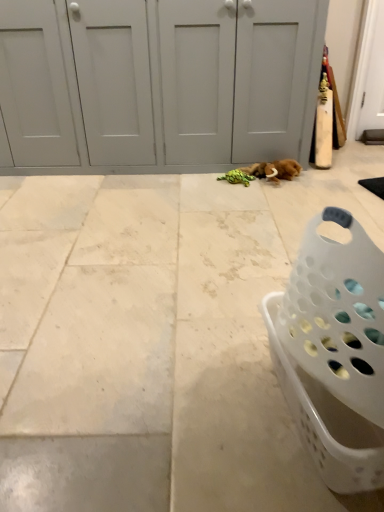
Question: Considering the relative positions of white tile floor at center and white plastic laundry basket at lower right in the image provided, is white tile floor at center to the right of white plastic laundry basket at lower right from the viewer's perspective?

Choices:
 (A) yes
 (B) no

Answer: (B)

Question: Is white tile floor at center at the left side of white plastic laundry basket at lower right?

Choices:
 (A) no
 (B) yes

Answer: (B)

Question: From a real-world perspective, does white tile floor at center stand above white plastic laundry basket at lower right?

Choices:
 (A) no
 (B) yes

Answer: (A)

Question: Is white tile floor at center far away from white plastic laundry basket at lower right?

Choices:
 (A) yes
 (B) no

Answer: (B)

Question: Does white tile floor at center have a greater width compared to white plastic laundry basket at lower right?

Choices:
 (A) yes
 (B) no

Answer: (A)

Question: Does white tile floor at center contain white plastic laundry basket at lower right?

Choices:
 (A) no
 (B) yes

Answer: (A)

Question: Does white plastic laundry basket at lower right have a greater width compared to white matte door at center?

Choices:
 (A) no
 (B) yes

Answer: (A)

Question: Does white plastic laundry basket at lower right have a smaller size compared to white matte door at center?

Choices:
 (A) yes
 (B) no

Answer: (A)

Question: Is white plastic laundry basket at lower right to the left of white matte door at center from the viewer's perspective?

Choices:
 (A) yes
 (B) no

Answer: (B)

Question: Is white plastic laundry basket at lower right bigger than white matte door at center?

Choices:
 (A) no
 (B) yes

Answer: (A)

Question: Can you confirm if white plastic laundry basket at lower right is positioned to the right of white matte door at center?

Choices:
 (A) yes
 (B) no

Answer: (A)

Question: Is white plastic laundry basket at lower right outside white matte door at center?

Choices:
 (A) yes
 (B) no

Answer: (A)

Question: From a real-world perspective, is white matte door at center physically above white tile floor at center?

Choices:
 (A) no
 (B) yes

Answer: (B)